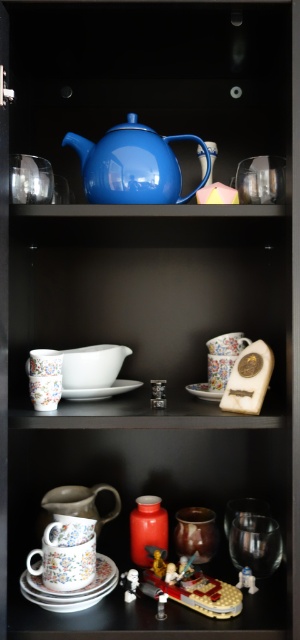
You are standing in front of the cabinet and want to reach a point that is exactly 3.29 feet away from you. Can you confirm if the point at coordinates point (87,195) is the correct location to reach?

The point at coordinates point (87,195) is exactly 3.29 feet away from the viewer, so yes, this is the correct location to reach.

You are organizing the middle shelf of the dark wooden cabinet and need to place a new item between the white matte saucer at center and the white glossy saucer at center. Where should you place it to ensure it fits between them?

The white matte saucer at center is to the left of the white glossy saucer at center, so placing the new item between them would require positioning it to the right of the white matte saucer at center and to the left of the white glossy saucer at center.